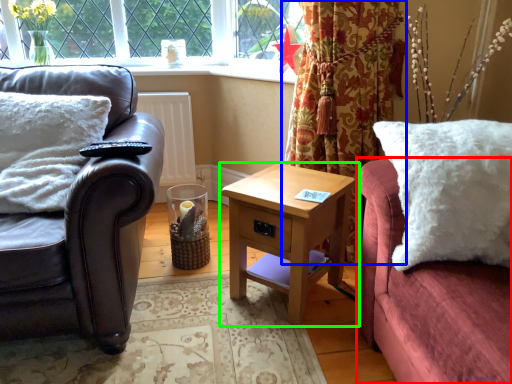
Question: Which object is the farthest from couch (highlighted by a red box)? Choose among these: curtain (highlighted by a blue box) or nightstand (highlighted by a green box).

Choices:
 (A) curtain
 (B) nightstand

Answer: (A)